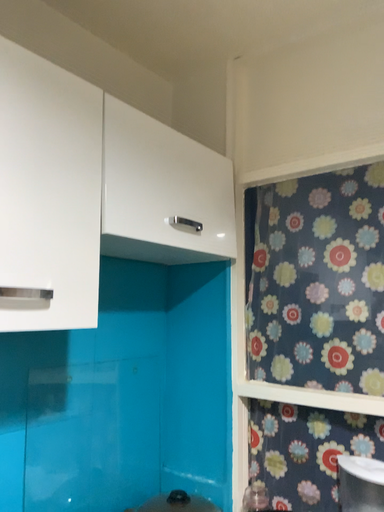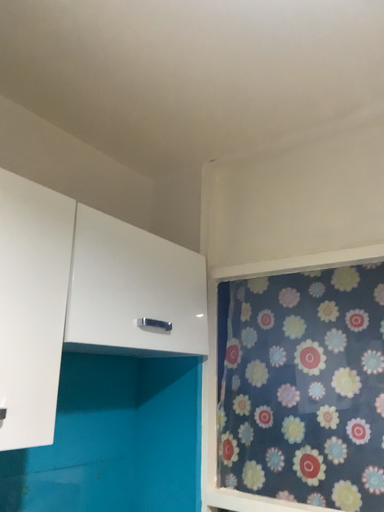
Question: Which way did the camera rotate in the video?

Choices:
 (A) rotated upward
 (B) rotated downward

Answer: (A)